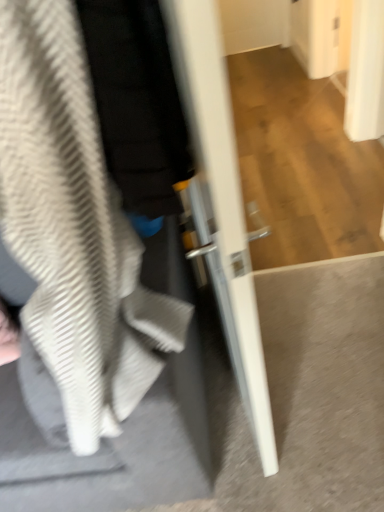
Image resolution: width=384 pixels, height=512 pixels. What do you see at coordinates (71, 227) in the screenshot?
I see `textured gray sweatshirt at left` at bounding box center [71, 227].

Locate an element on the screen. Image resolution: width=384 pixels, height=512 pixels. textured gray sweatshirt at left is located at coordinates (71, 227).

The height and width of the screenshot is (512, 384). What do you see at coordinates (221, 202) in the screenshot?
I see `white glossy door at center` at bounding box center [221, 202].

From the picture: What is the approximate height of white glossy door at center?

4.05 feet.

Measure the distance between point (254, 301) and camera.

The depth of point (254, 301) is 1.70 meters.

Find the location of a particular element. white glossy door at center is located at coordinates (221, 202).

Where is `textured gray sweatshirt at left`? The height and width of the screenshot is (512, 384). textured gray sweatshirt at left is located at coordinates (71, 227).

Considering the relative positions of textured gray sweatshirt at left and white glossy door at center in the image provided, is textured gray sweatshirt at left to the right of white glossy door at center from the viewer's perspective?

No.

Does textured gray sweatshirt at left lie behind white glossy door at center?

Yes, the depth of textured gray sweatshirt at left is greater than that of white glossy door at center.

Is point (102, 238) farther from camera compared to point (202, 74)?

Yes.

From the image's perspective, is textured gray sweatshirt at left above or below white glossy door at center?

Based on their image positions, textured gray sweatshirt at left is located beneath white glossy door at center.

From a real-world perspective, which object stands above the other?

white glossy door at center, from a real-world perspective.

Is textured gray sweatshirt at left wider than white glossy door at center?

Yes, textured gray sweatshirt at left is wider than white glossy door at center.

In terms of height, does textured gray sweatshirt at left look taller or shorter compared to white glossy door at center?

In the image, textured gray sweatshirt at left appears to be shorter than white glossy door at center.

Based on the photo, is textured gray sweatshirt at left bigger or smaller than white glossy door at center?

Considering their sizes, textured gray sweatshirt at left takes up more space than white glossy door at center.

Would you say textured gray sweatshirt at left is inside or outside white glossy door at center?

textured gray sweatshirt at left is not enclosed by white glossy door at center.

Is textured gray sweatshirt at left beside white glossy door at center?

textured gray sweatshirt at left and white glossy door at center are clearly separated.

Is textured gray sweatshirt at left facing away from white glossy door at center?

No.

You are a GUI agent. You are given a task and a screenshot of the screen. Output one action in this format:
    pyautogui.click(x=<x>, y=<y>)
    Task: Click on the sweatshirt lying behind the white glossy door at center
    Image resolution: width=384 pixels, height=512 pixels.
    Given the screenshot: What is the action you would take?
    pyautogui.click(x=71, y=227)

Between white glossy door at center and textured gray sweatshirt at left, which one appears on the right side from the viewer's perspective?

From the viewer's perspective, white glossy door at center appears more on the right side.

Which object is further away from the camera, white glossy door at center or textured gray sweatshirt at left?

textured gray sweatshirt at left is further away from the camera.

Does point (252, 283) come closer to viewer compared to point (75, 84)?

No, (252, 283) is further to viewer.

From the image's perspective, is white glossy door at center above or below textured gray sweatshirt at left?

Clearly, from the image's perspective, white glossy door at center is above textured gray sweatshirt at left.

From a real-world perspective, is white glossy door at center positioned under textured gray sweatshirt at left based on gravity?

No, from a real-world perspective, white glossy door at center is not under textured gray sweatshirt at left.

In terms of width, does white glossy door at center look wider or thinner when compared to textured gray sweatshirt at left?

white glossy door at center is thinner than textured gray sweatshirt at left.

Is white glossy door at center taller than textured gray sweatshirt at left?

Yes.

Does white glossy door at center have a smaller size compared to textured gray sweatshirt at left?

Yes.

Do you think white glossy door at center is within textured gray sweatshirt at left, or outside of it?

white glossy door at center cannot be found inside textured gray sweatshirt at left.

Looking at this image, is white glossy door at center touching textured gray sweatshirt at left?

There is a gap between white glossy door at center and textured gray sweatshirt at left.

Is white glossy door at center oriented towards textured gray sweatshirt at left?

Yes, white glossy door at center is aimed at textured gray sweatshirt at left.

How different are the orientations of white glossy door at center and textured gray sweatshirt at left in degrees?

98 degrees.

The image size is (384, 512). Find the location of `sweatshirt below the white glossy door at center (from a real-world perspective)`. sweatshirt below the white glossy door at center (from a real-world perspective) is located at coordinates (71, 227).

Find the location of a particular element. The width and height of the screenshot is (384, 512). sweatshirt on the left of white glossy door at center is located at coordinates (71, 227).

You are a GUI agent. You are given a task and a screenshot of the screen. Output one action in this format:
    pyautogui.click(x=<x>, y=<y>)
    Task: Click on the door on the right of textured gray sweatshirt at left
    The image size is (384, 512).
    Given the screenshot: What is the action you would take?
    221,202